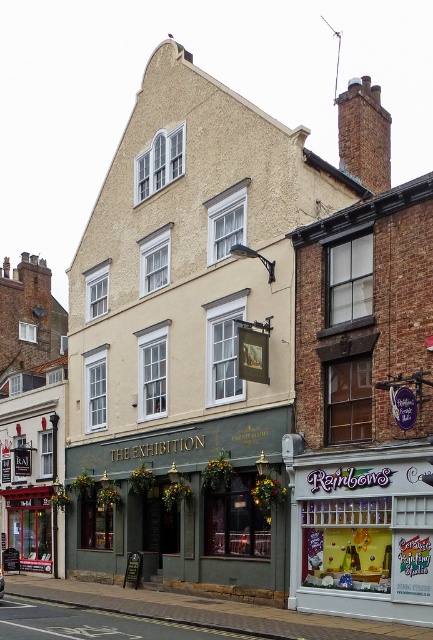
You are a pedestrian standing on the sidewalk in front of The Exhibition. You want to cross the street to reach a park on the other side. However, there is a green matte pub at center and a metallic silver car at center in your path. Which object is closer to you, and can you safely walk around it to cross the street?

The green matte pub at center is closer to you since the metallic silver car at center is behind it. You can safely walk around the green matte pub at center to cross the street as long as there is enough space on either side of it.

You are standing at the point marked by coordinates [190,506] in the street scene. What is the closest object to you?

The point marked by coordinates [190,506] indicates the green matte pub at center, so the closest object to you is the green matte pub at center.

You are a delivery person who needs to park your metallic silver car at center near the green matte pub at center. However, there is a height restriction sign stating that the maximum allowed height for parking is 2 meters. Can you safely park your car there?

The green matte pub at center is much taller than the metallic silver car at center. Since the pub is taller, it does not indicate the car height. However, the height restriction is 2 meters. Without knowing the car height, it is impossible to determine if it can park safely. Please check the car height first.